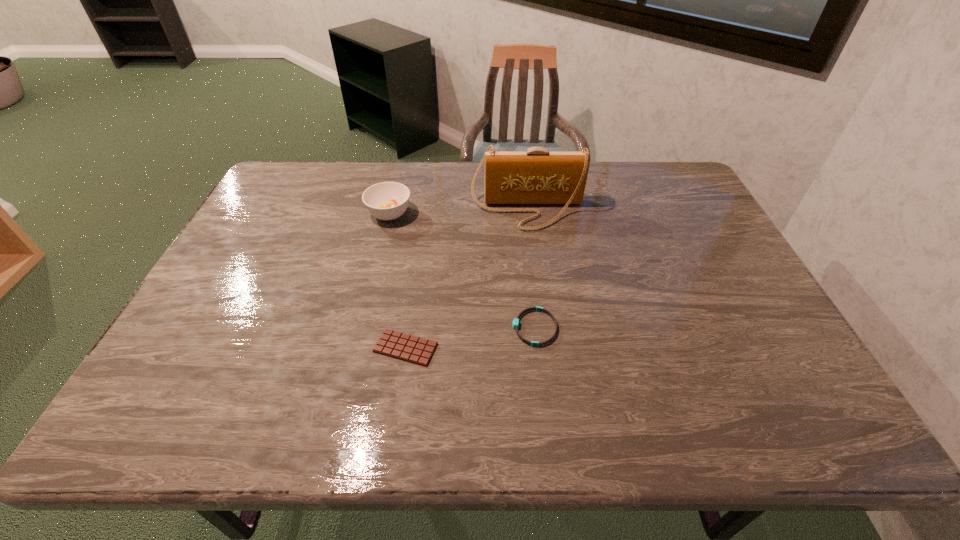
You are a GUI agent. You are given a task and a screenshot of the screen. Output one action in this format:
    pyautogui.click(x=<x>, y=<y>)
    Task: Click on the vacant space that satisfies the following two spatial constraints: 1. on the decorative side of the handbag; 2. on the buckle of the wristband
    The height and width of the screenshot is (540, 960).
    Given the screenshot: What is the action you would take?
    click(541, 328)

At what (x,y) coordinates should I click in order to perform the action: click on free spot that satisfies the following two spatial constraints: 1. on the decorative side of the tallest object; 2. on the buckle of the wristband. Please return your answer as a coordinate pair (x, y). The height and width of the screenshot is (540, 960). Looking at the image, I should click on (541, 328).